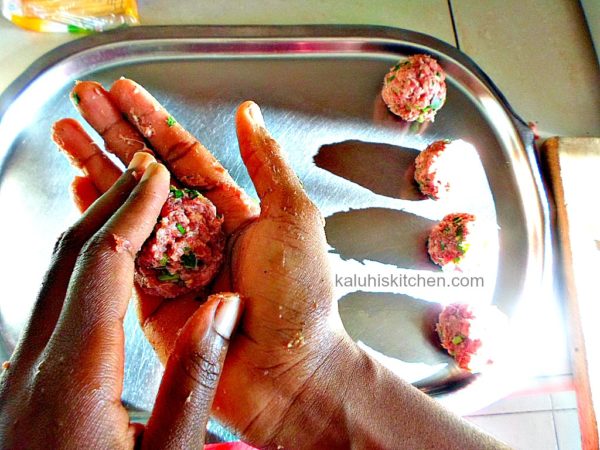
At what (x,y) coordinates should I click in order to perform the action: click on flooring. Please return your answer as a coordinate pair (x, y). Looking at the image, I should click on (516, 421).